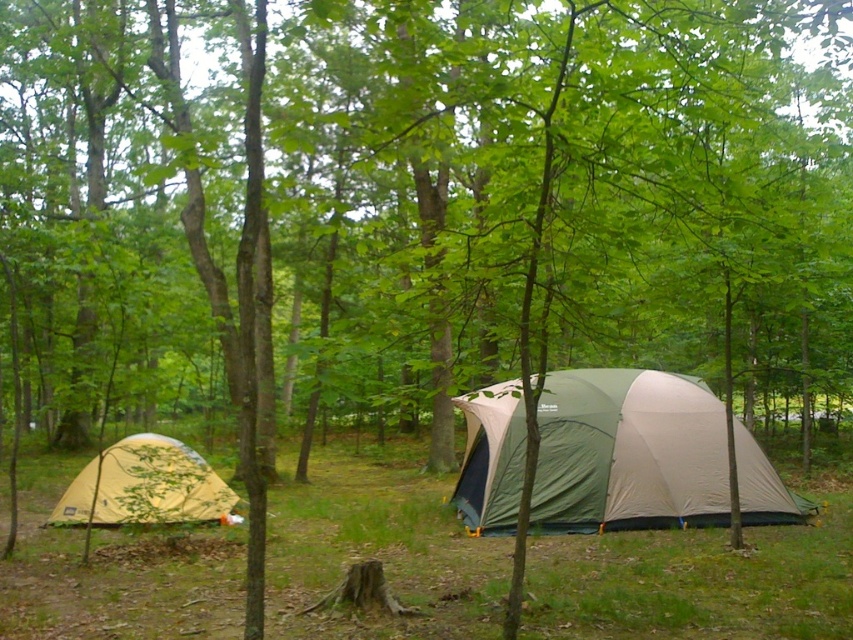
Can you confirm if green fabric tent at center is smaller than yellow fabric tent at lower left?

Incorrect, green fabric tent at center is not smaller in size than yellow fabric tent at lower left.

Which is in front, point (643, 467) or point (102, 490)?

Point (102, 490) is in front.

Identify the location of green fabric tent at center. (628, 452).